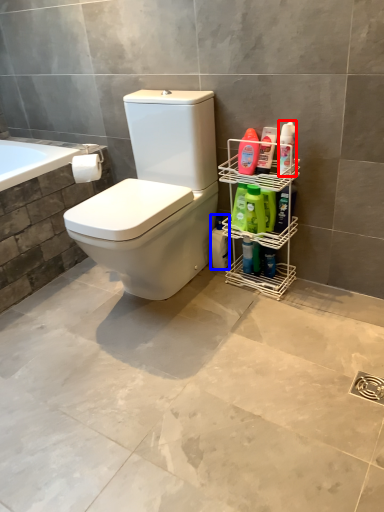
Question: Which point is further to the camera, cleaning product (highlighted by a red box) or cleaning product (highlighted by a blue box)?

Choices:
 (A) cleaning product
 (B) cleaning product

Answer: (B)